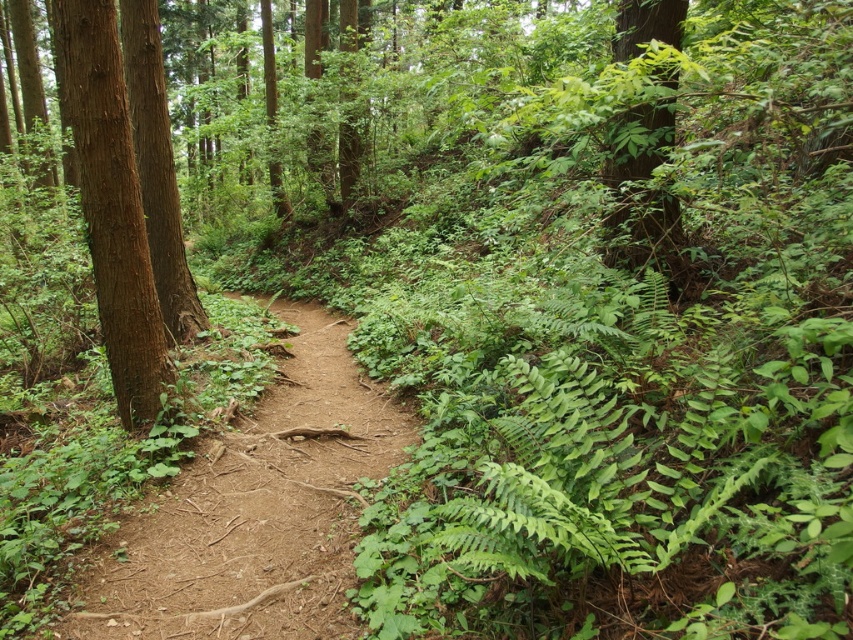
Question: Does brown rough bark tree at left appear on the right side of green leafy tree at upper right?

Choices:
 (A) no
 (B) yes

Answer: (A)

Question: Estimate the real-world distances between objects in this image. Which object is closer to the green leafy tree at upper right?

Choices:
 (A) brown rough bark tree at left
 (B) dirt path at center

Answer: (B)

Question: Which object appears closest to the camera in this image?

Choices:
 (A) dirt path at center
 (B) brown rough bark tree at left
 (C) brown rough tree at left

Answer: (B)

Question: Which of the following is the farthest from the observer?

Choices:
 (A) dirt path at center
 (B) brown rough bark tree at left
 (C) green leafy tree at upper right

Answer: (A)

Question: Is dirt path at center bigger than brown rough tree at left?

Choices:
 (A) no
 (B) yes

Answer: (A)

Question: Observing the image, what is the correct spatial positioning of dirt path at center in reference to green leafy tree at upper right?

Choices:
 (A) right
 (B) left

Answer: (B)